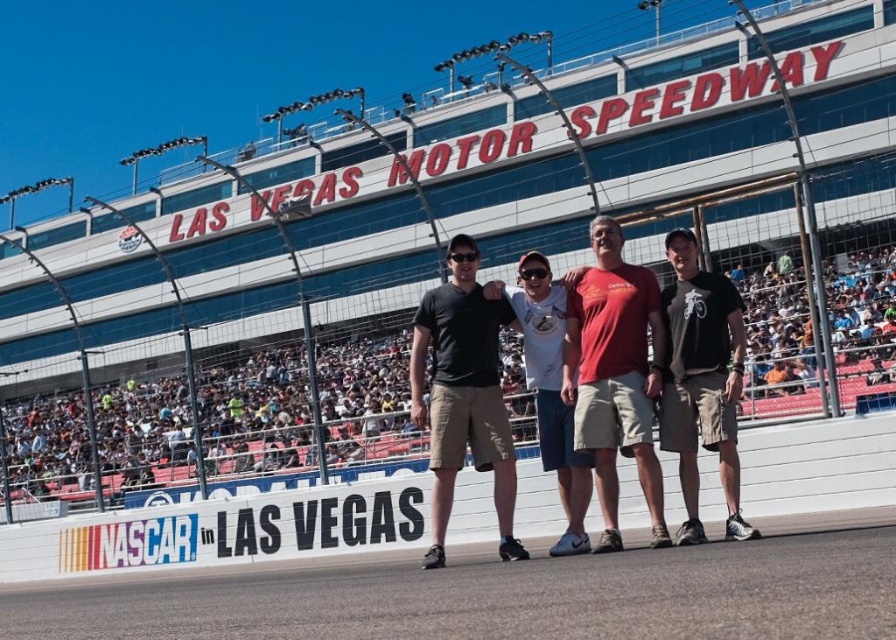
Question: Is gray asphalt dirt track at lower center positioned at the back of matte red t-shirt at center?

Choices:
 (A) no
 (B) yes

Answer: (A)

Question: Does gray asphalt dirt track at lower center appear on the right side of matte red t-shirt at center?

Choices:
 (A) no
 (B) yes

Answer: (A)

Question: Which point is closer to the camera?

Choices:
 (A) (571, 458)
 (B) (694, 445)
 (C) (500, 593)
 (D) (436, 301)

Answer: (C)

Question: Is gray asphalt dirt track at lower center below matte black t-shirt at center?

Choices:
 (A) no
 (B) yes

Answer: (B)

Question: Which object is the closest to the matte black t-shirt at center?

Choices:
 (A) gray asphalt dirt track at lower center
 (B) matte red t-shirt at center
 (C) white cotton t-shirt at center
 (D) black cotton t-shirt at right

Answer: (C)

Question: Which point is closer to the camera taking this photo?

Choices:
 (A) pos(631,582)
 (B) pos(685,256)
 (C) pos(573,525)
 (D) pos(627,401)

Answer: (A)